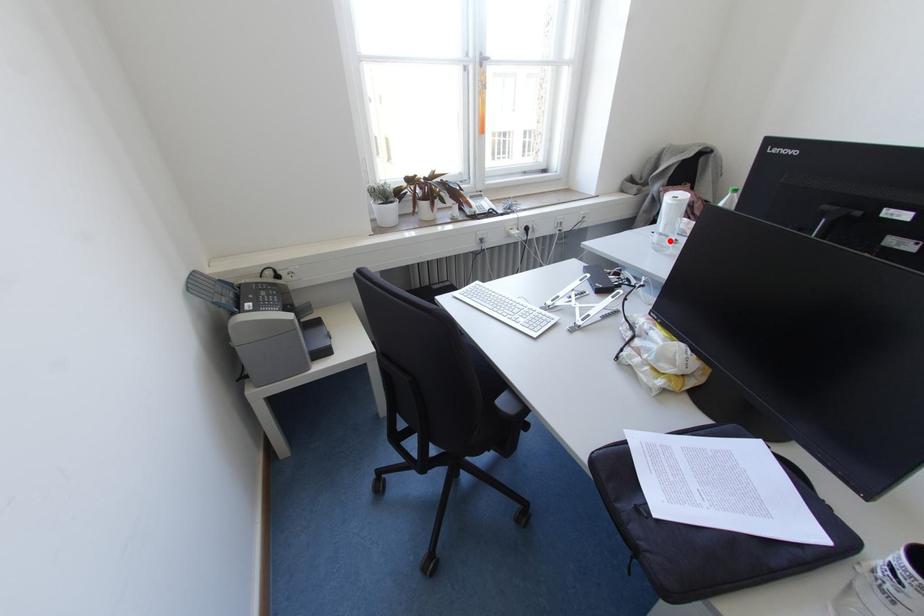
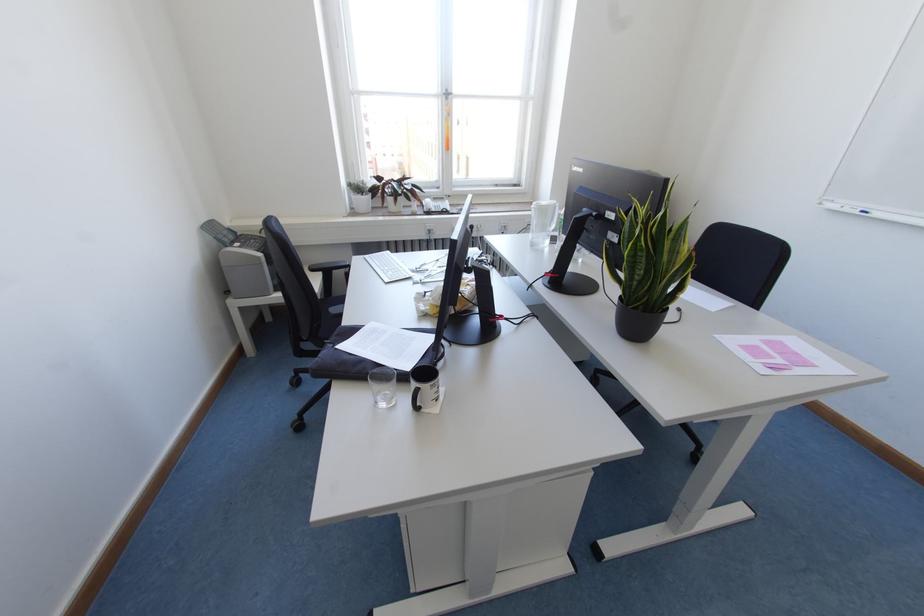
Where in the second image is the point corresponding to the highlighted location from the first image?

(548, 240)